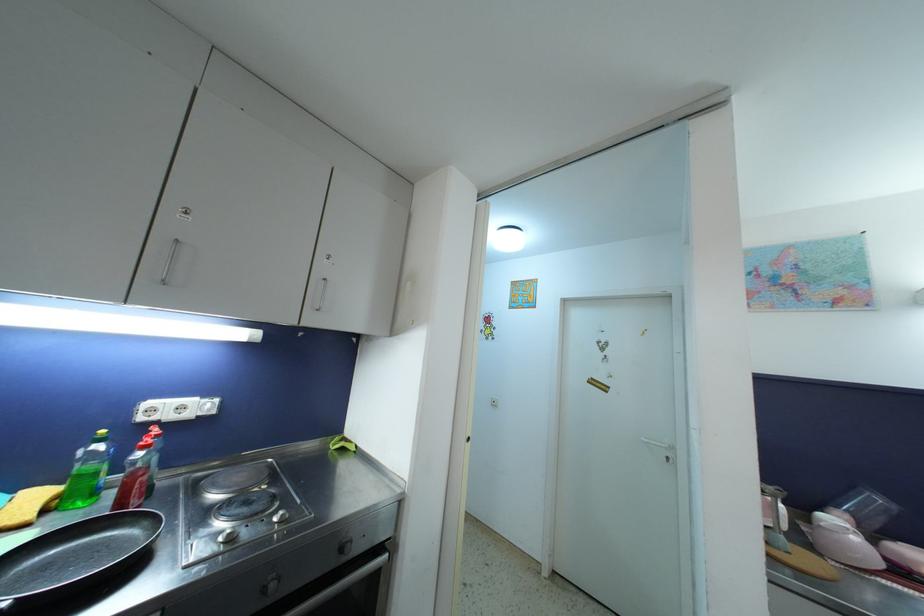
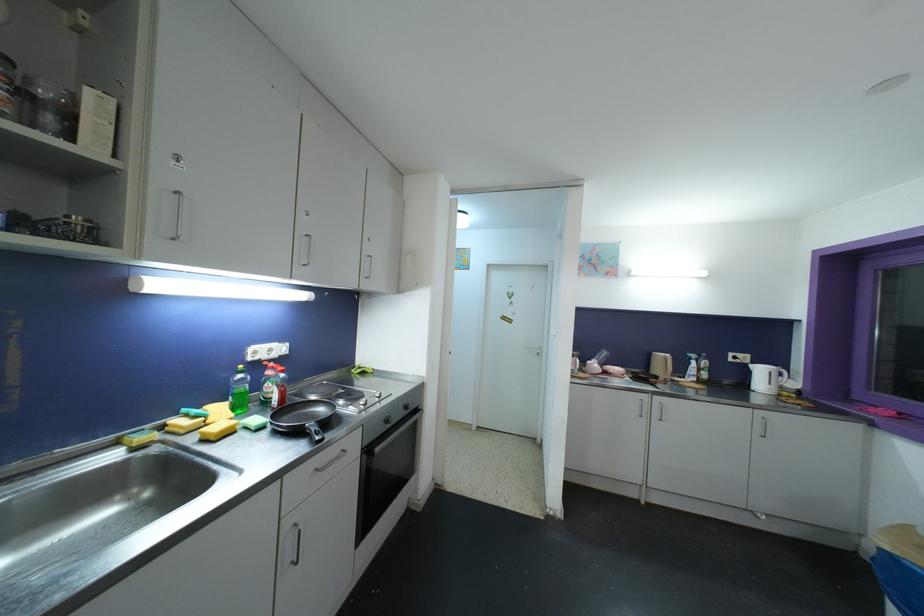
The point at (102, 448) is marked in the first image. Where is the corresponding point in the second image?

(244, 379)